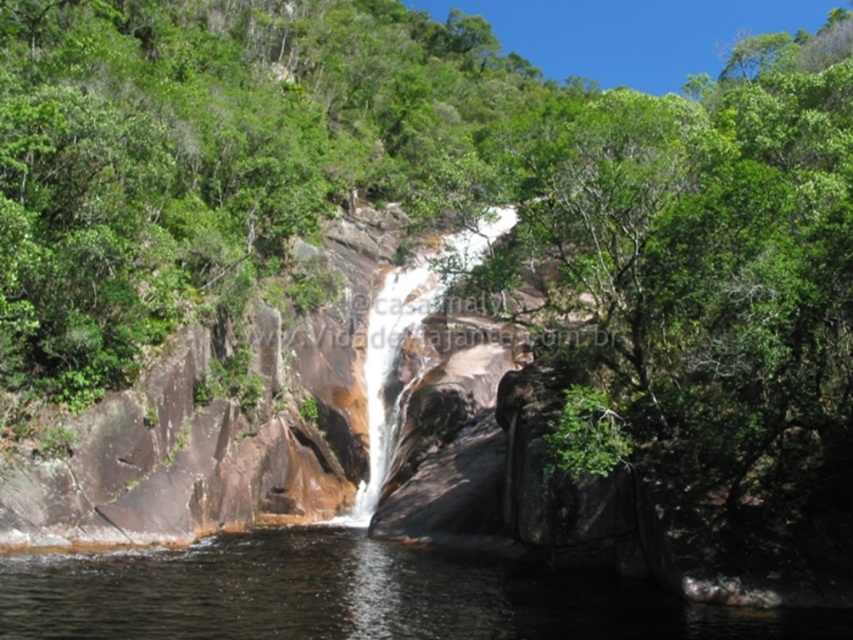
Based on the photo, is clear water at center shorter than white smooth waterfall at center?

Yes, clear water at center is shorter than white smooth waterfall at center.

Between clear water at center and white smooth waterfall at center, which one appears on the right side from the viewer's perspective?

white smooth waterfall at center is more to the right.

Who is more forward, (61, 624) or (399, 401)?

Point (61, 624)

The width and height of the screenshot is (853, 640). Identify the location of clear water at center. (354, 595).